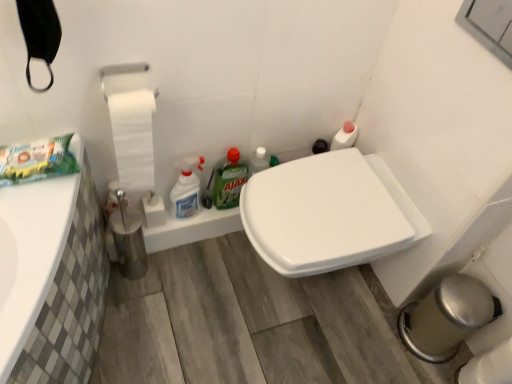
Identify the location of vacant area situated to the left side of white glossy toilet seat at center. The height and width of the screenshot is (384, 512). (186, 299).